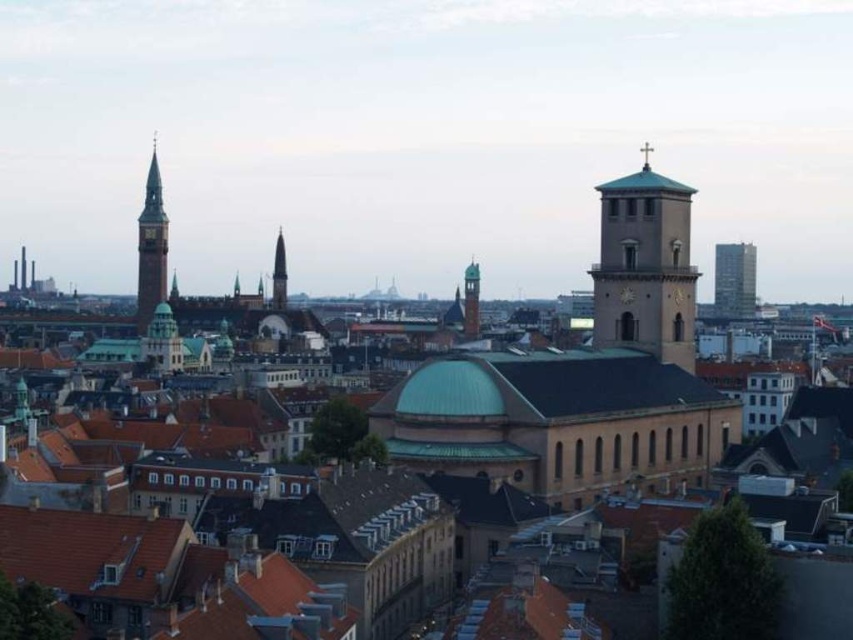
You are standing at the point with coordinates point (282,243) and want to walk to the point with coordinates point (149,173). Which direction should you move in to reach your destination?

You should move forward towards point (149,173) because it is in front of point (282,243).

Consider the image. You are an architect analyzing the cityscape. You need to determine which of the two structures, the smooth brown clock tower at left or the green glass skyscraper at upper right, has a smaller width. Based on the scene, which one is narrower?

The smooth brown clock tower at left is thinner than the green glass skyscraper at upper right, so the smooth brown clock tower at left is narrower.

You are standing at the center of the city square and want to take a photo of the smooth brown clock tower at left. Which direction should you face to ensure the tower is in the frame?

The smooth brown clock tower at left is located at point (151, 246), which means it is positioned to the left side of the scene. To capture it in your photo, you should face towards the left direction from the center of the city square.